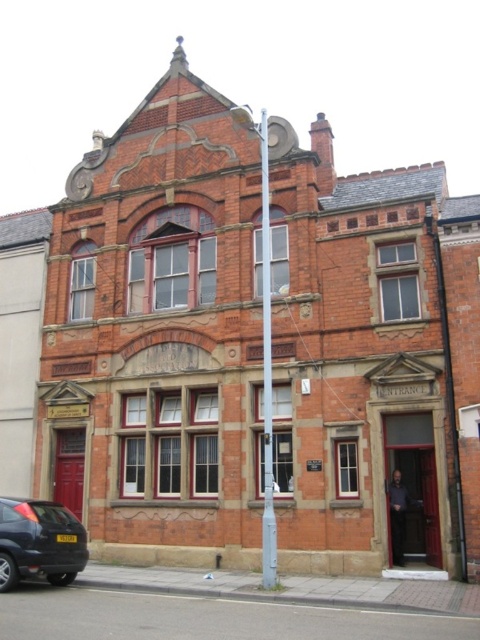
Question: Which of the following is the farthest from the observer?

Choices:
 (A) (262, 129)
 (B) (73, 566)

Answer: (A)

Question: Among these points, which one is nearest to the camera?

Choices:
 (A) (48, 509)
 (B) (262, 176)

Answer: (A)

Question: Can you confirm if matte black car at lower left is thinner than metallic pole at center?

Choices:
 (A) yes
 (B) no

Answer: (A)

Question: Is matte black car at lower left thinner than metallic pole at center?

Choices:
 (A) no
 (B) yes

Answer: (B)

Question: Is matte black car at lower left positioned in front of metallic pole at center?

Choices:
 (A) no
 (B) yes

Answer: (B)